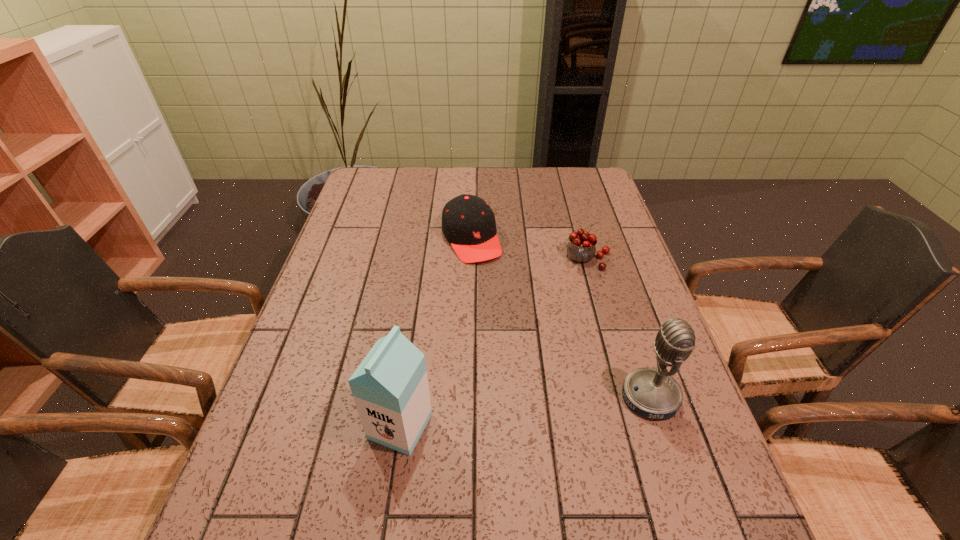
Where is `free point located 0.100m on the handle side of the pot filled with cherries`? The width and height of the screenshot is (960, 540). free point located 0.100m on the handle side of the pot filled with cherries is located at coordinates (580, 295).

The image size is (960, 540). What are the coordinates of `object at the near edge` in the screenshot? It's located at (390, 388).

The width and height of the screenshot is (960, 540). I want to click on microphone at the right edge, so click(654, 393).

The height and width of the screenshot is (540, 960). Identify the location of pot filled with cherries at the right edge. (581, 248).

Find the location of a particular element. The height and width of the screenshot is (540, 960). vacant position at the far edge of the desktop is located at coordinates (558, 185).

You are a GUI agent. You are given a task and a screenshot of the screen. Output one action in this format:
    pyautogui.click(x=<x>, y=<y>)
    Task: Click on the free space at the near edge of the desktop
    Image resolution: width=960 pixels, height=540 pixels.
    Given the screenshot: What is the action you would take?
    pyautogui.click(x=423, y=465)

The height and width of the screenshot is (540, 960). In the image, there is a desktop. What are the coordinates of `vacant space at the left edge` in the screenshot? It's located at (276, 442).

In the image, there is a desktop. Where is `vacant space at the right edge`? vacant space at the right edge is located at coordinates (631, 332).

In the image, there is a desktop. Where is `vacant area at the near left corner`? The width and height of the screenshot is (960, 540). vacant area at the near left corner is located at coordinates (292, 476).

In the image, there is a desktop. Where is `vacant area at the far right corner`? The image size is (960, 540). vacant area at the far right corner is located at coordinates (573, 184).